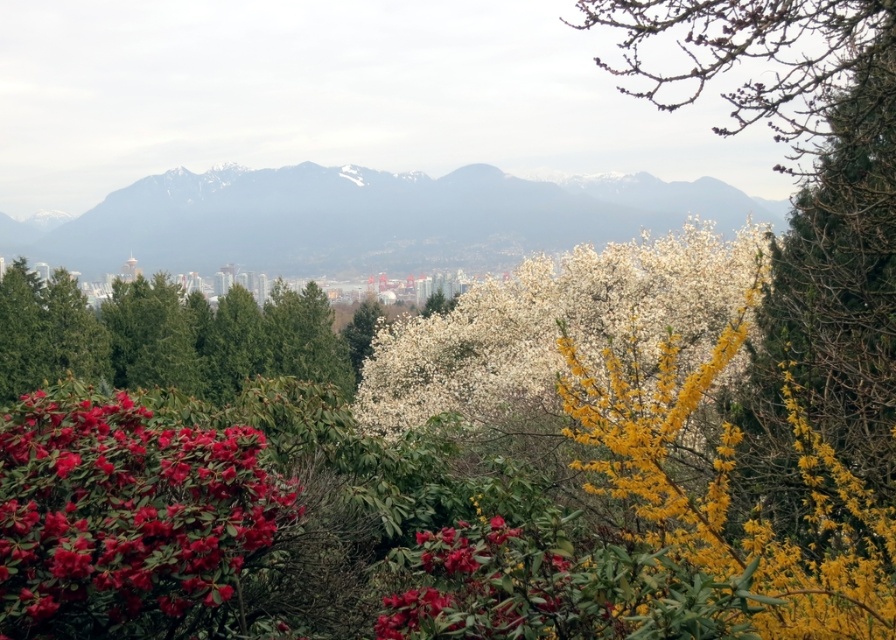
Question: Estimate the real-world distances between objects in this image. Which object is closer to the green matte tree at left?

Choices:
 (A) white fluffy blossoms at center
 (B) matte red flowers at lower left

Answer: (A)

Question: Among these points, which one is farthest from the camera?

Choices:
 (A) (554, 241)
 (B) (421, 369)
 (C) (194, 532)

Answer: (A)

Question: Does snowy mountain range at upper center have a lesser width compared to matte red flowers at lower left?

Choices:
 (A) no
 (B) yes

Answer: (A)

Question: Can you confirm if white fluffy blossoms at center is positioned to the left of matte red flower at lower left?

Choices:
 (A) yes
 (B) no

Answer: (B)

Question: Does white fluffy blossoms at center have a lesser width compared to matte red flower at lower left?

Choices:
 (A) no
 (B) yes

Answer: (A)

Question: Which of these objects is positioned closest to the white fluffy blossoms at center?

Choices:
 (A) green matte tree at left
 (B) matte red flowers at lower left
 (C) snowy mountain range at upper center

Answer: (B)